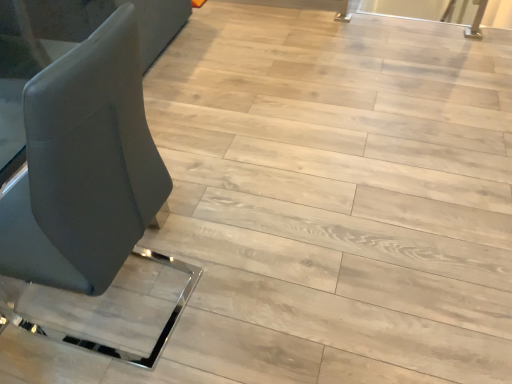
Image resolution: width=512 pixels, height=384 pixels. What are the coordinates of `matte gray chair at left` in the screenshot? It's located at (90, 206).

The width and height of the screenshot is (512, 384). What do you see at coordinates (90, 206) in the screenshot?
I see `matte gray chair at left` at bounding box center [90, 206].

Where is `matte gray chair at left`? This screenshot has width=512, height=384. matte gray chair at left is located at coordinates (90, 206).